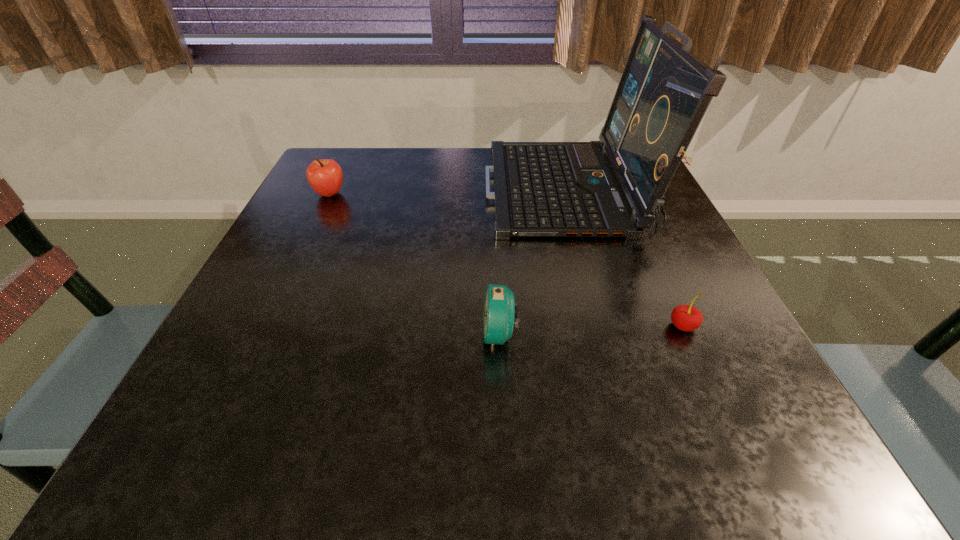
Where is `free area in between the alarm clock and the apple`? This screenshot has height=540, width=960. free area in between the alarm clock and the apple is located at coordinates (415, 264).

At what (x,y) coordinates should I click in order to perform the action: click on vacant space in between the tallest object and the cherry. Please return your answer as a coordinate pair (x, y). Looking at the image, I should click on (625, 259).

Locate an element on the screen. This screenshot has width=960, height=540. free space between the cherry and the apple is located at coordinates (506, 260).

Identify the location of object that is the third closest one to the tallest object. (325, 176).

Locate which object ranks in proximity to the cherry. Please provide its 2D coordinates. Your answer should be formatted as a tuple, i.e. [(x, y)], where the tuple contains the x and y coordinates of a point satisfying the conditions above.

[(541, 189)]

This screenshot has height=540, width=960. I want to click on free location that satisfies the following two spatial constraints: 1. on the front-facing side of the laptop computer; 2. on the front side of the leftmost object, so click(568, 194).

At what (x,y) coordinates should I click in order to perform the action: click on free spot that satisfies the following two spatial constraints: 1. on the front-facing side of the cherry; 2. on the right side of the tallest object. Please return your answer as a coordinate pair (x, y). The height and width of the screenshot is (540, 960). Looking at the image, I should click on (605, 326).